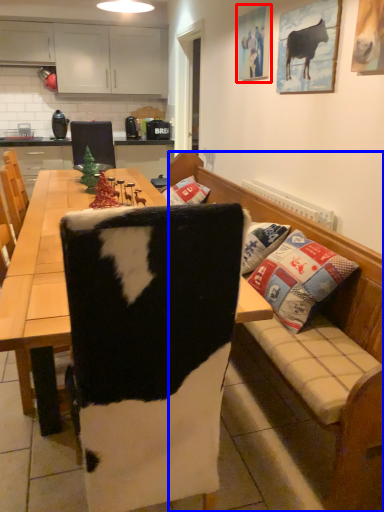
Question: Which of the following is the closest to the observer, picture frame (highlighted by a red box) or studio couch (highlighted by a blue box)?

Choices:
 (A) picture frame
 (B) studio couch

Answer: (B)